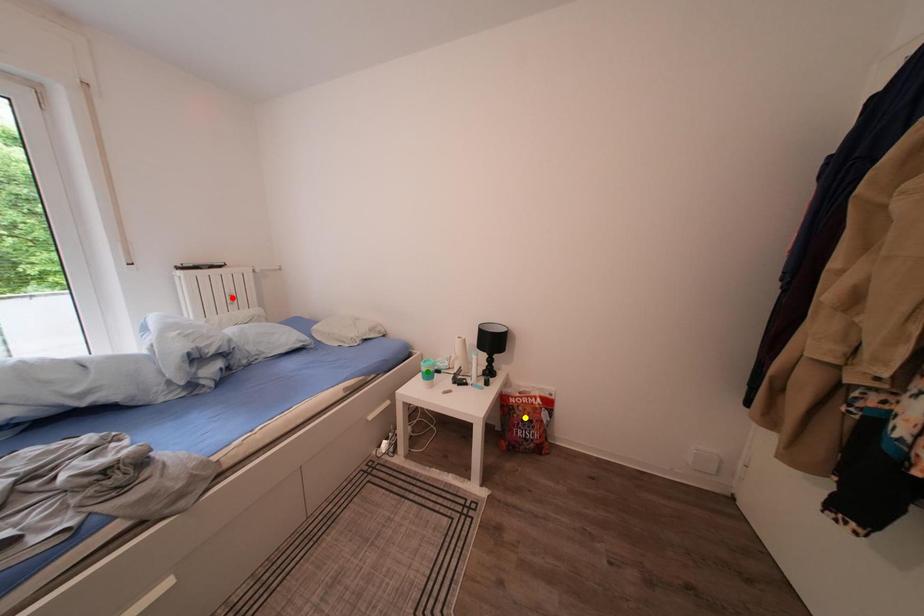
Order these from nearest to farthest:
yellow point
green point
red point

green point, yellow point, red point